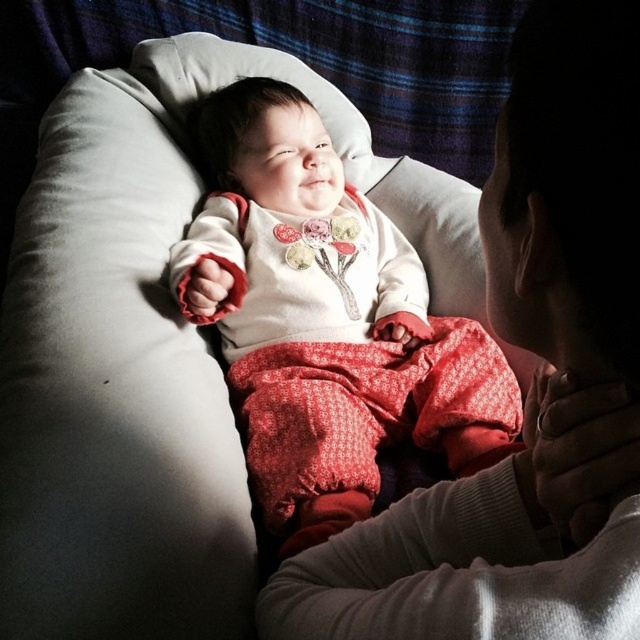
You are a photographer observing this touching scene. You need to capture a closeup of the baby while ensuring the adult remains in the frame. Based on their positions, which side should you position your camera to include both the white soft fabric baby at center and the white soft fabric at upper center?

The white soft fabric at upper center is to the right of the white soft fabric baby at center, so positioning the camera to the left side would allow both the baby and the fabric to be included in the frame.

You are a photographer setting up a studio for a family photo. The scene includes a white soft fabric at upper center and a white soft fabric baby at center. Which object should you focus on first if you want to capture the larger subject?

The white soft fabric baby at center is larger than the white soft fabric at upper center, so you should focus on the white soft fabric baby at center first.

You are a photographer trying to capture the baby and the adult in the scene. The white soft fabric at upper center is part of the baby or the adult?

The white soft fabric at upper center is part of the baby, as it is described as the baby lying comfortably on a soft, light gray pillow. The white soft fabric might be the baby clothing or bedding.